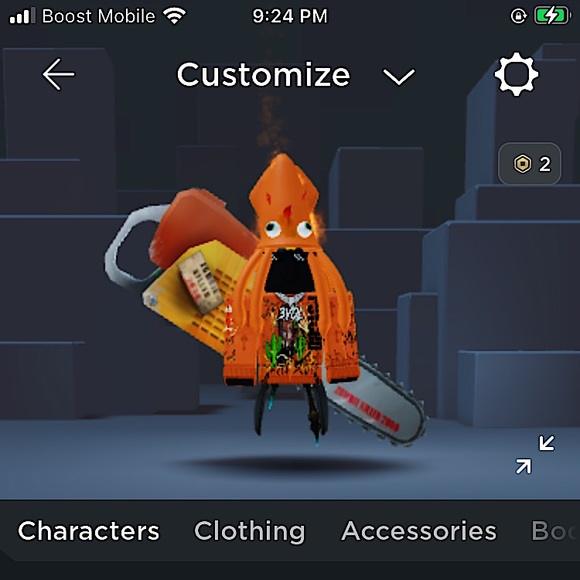
Locate an element on the screen. The image size is (580, 580). handle is located at coordinates (113, 271).